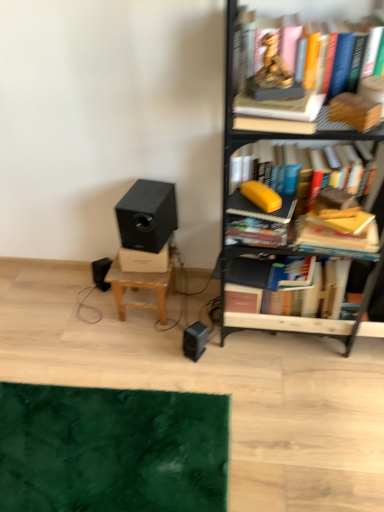
I want to click on vacant area that is in front of black plastic speaker at lower center, so click(203, 386).